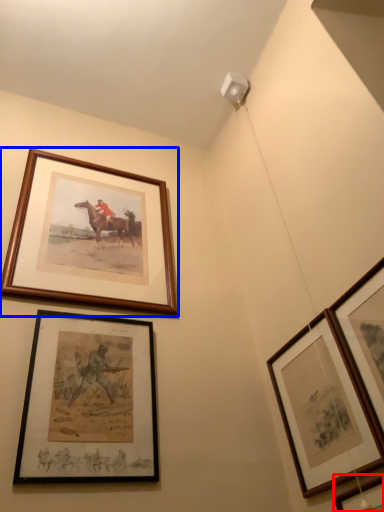
Question: Which object appears closest to the camera in this image, picture frame (highlighted by a red box) or picture frame (highlighted by a blue box)?

Choices:
 (A) picture frame
 (B) picture frame

Answer: (A)